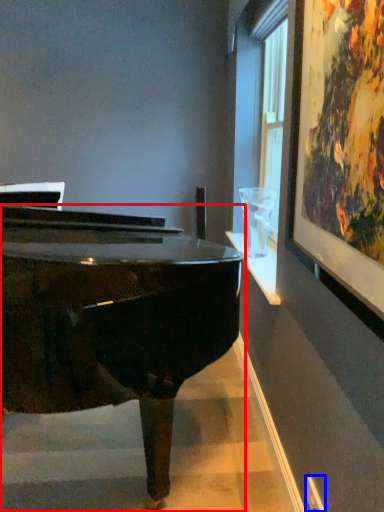
Question: Which of the following is the farthest to the observer, piano (highlighted by a red box) or power outlet (highlighted by a blue box)?

Choices:
 (A) piano
 (B) power outlet

Answer: (B)